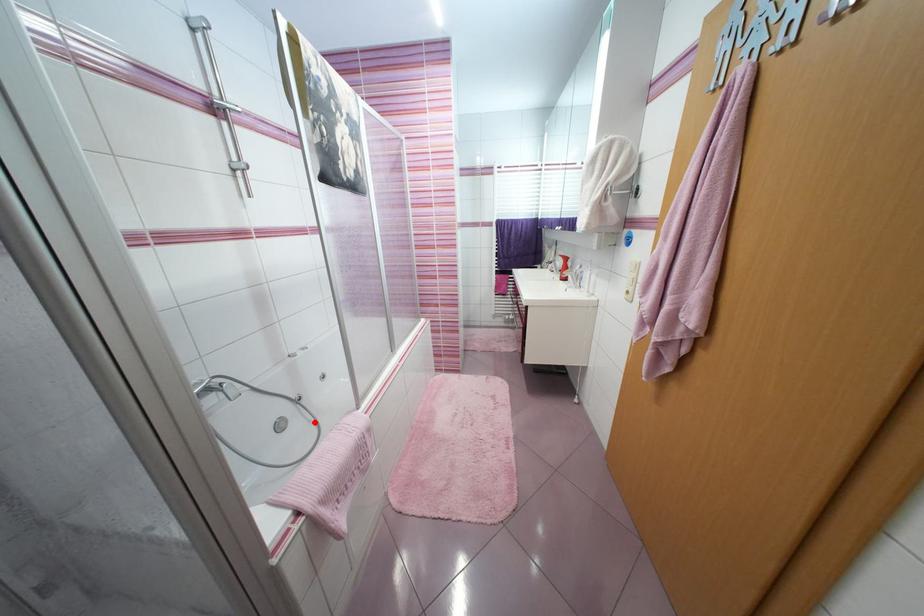
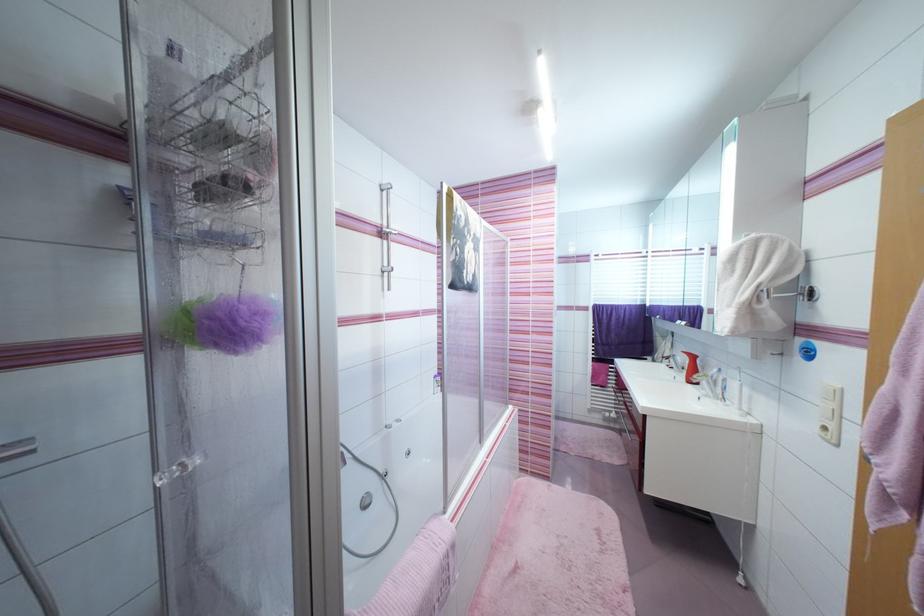
In the second image, find the point that corresponds to the highlighted location in the first image.

(395, 504)